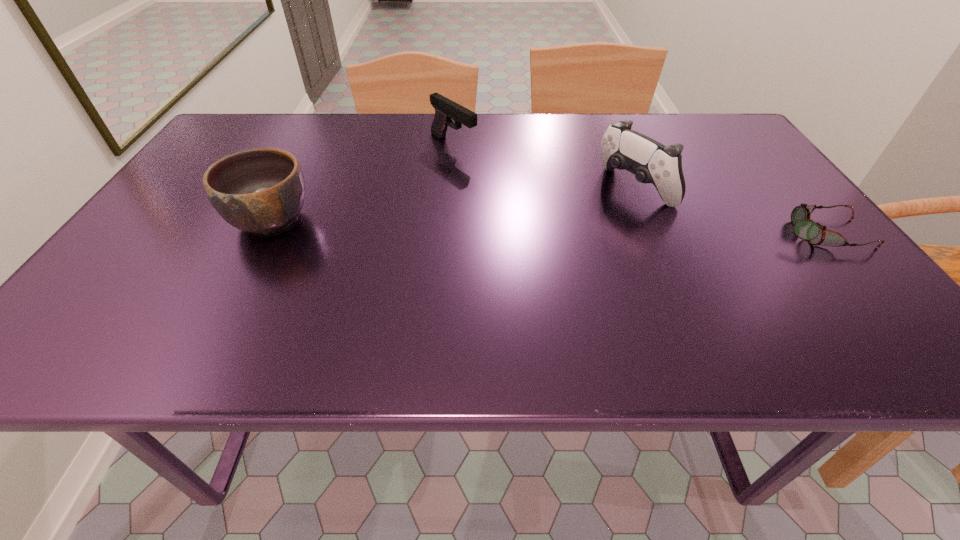
Where is `vacant space located 0.330m on the front-facing side of the third object from right to left`? vacant space located 0.330m on the front-facing side of the third object from right to left is located at coordinates (563, 213).

At what (x,y) coordinates should I click in order to perform the action: click on free space located on the front-facing side of the third object from right to left. Please return your answer as a coordinate pair (x, y). The image size is (960, 540). Looking at the image, I should click on (494, 171).

Find the location of a particular element. Image resolution: width=960 pixels, height=540 pixels. vacant space situated on the front-facing side of the third object from right to left is located at coordinates (583, 226).

The height and width of the screenshot is (540, 960). I want to click on object that is at the far edge, so click(x=445, y=109).

This screenshot has width=960, height=540. Find the location of `object located in the right edge section of the desktop`. object located in the right edge section of the desktop is located at coordinates (804, 228).

Locate an element on the screen. This screenshot has height=540, width=960. vacant region at the far edge of the desktop is located at coordinates (449, 132).

In the image, there is a desktop. Where is `vacant area at the near edge`? The width and height of the screenshot is (960, 540). vacant area at the near edge is located at coordinates (692, 310).

The image size is (960, 540). In the image, there is a desktop. In order to click on blank space at the left edge in this screenshot , I will do pos(202,192).

Where is `vacant position at the right edge of the desktop`? This screenshot has height=540, width=960. vacant position at the right edge of the desktop is located at coordinates (828, 248).

In order to click on free space at the far right corner of the desktop in this screenshot , I will do `click(676, 122)`.